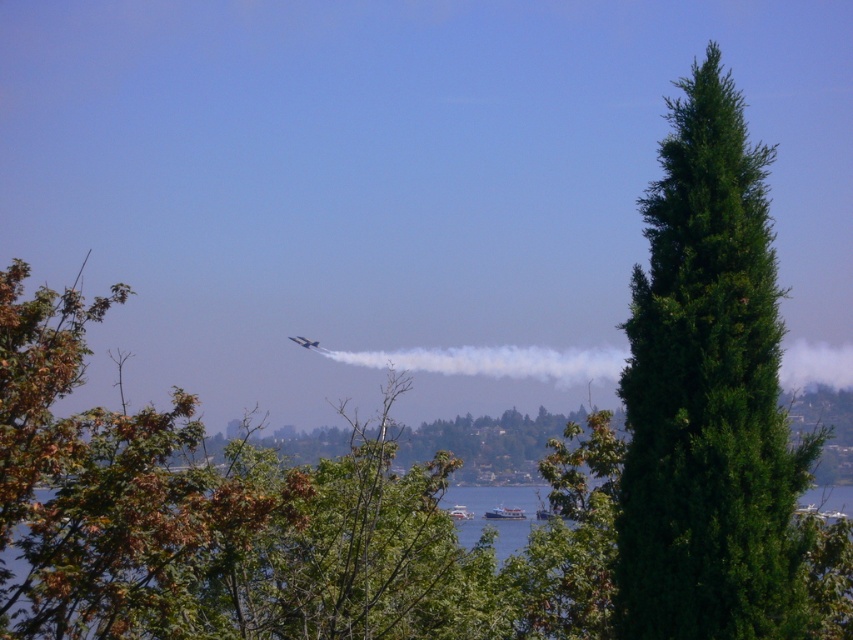
Does point (503, 518) come in front of point (465, 516)?

That is True.

How far apart are white plastic boat at lower center and white glossy boat at lower center?

white plastic boat at lower center is 15.33 inches from white glossy boat at lower center.

Between point (521, 516) and point (459, 509), which one is positioned in front?

Positioned in front is point (521, 516).

The image size is (853, 640). I want to click on white plastic boat at lower center, so click(503, 513).

Who is lower down, green leafy tree at center right or metallic silver airplane at center?

Positioned lower is green leafy tree at center right.

Does green leafy tree at center right appear on the left side of metallic silver airplane at center?

No, green leafy tree at center right is not to the left of metallic silver airplane at center.

Which is in front, point (398, 596) or point (297, 342)?

Point (398, 596) is more forward.

Image resolution: width=853 pixels, height=640 pixels. In order to click on green leafy tree at center right in this screenshot , I will do `click(262, 518)`.

Does white vapor trail at center have a lesser width compared to white glossy boat at lower center?

No, white vapor trail at center is not thinner than white glossy boat at lower center.

Is white vapor trail at center below white glossy boat at lower center?

Actually, white vapor trail at center is above white glossy boat at lower center.

Between point (412, 360) and point (469, 513), which one is positioned in front?

Point (469, 513) is in front.

Find the location of a particular element. Image resolution: width=853 pixels, height=640 pixels. white vapor trail at center is located at coordinates (497, 362).